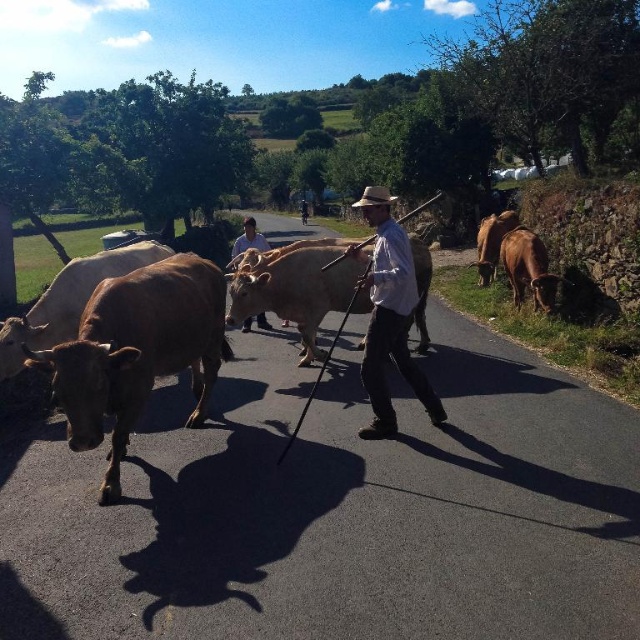
Does brown matte cow at left appear on the left side of brown matte bull at right?

Indeed, brown matte cow at left is positioned on the left side of brown matte bull at right.

Is brown matte cow at left further to the viewer compared to brown matte bull at right?

No, it is not.

Is point (125, 403) in front of point (547, 280)?

That is True.

Identify the location of brown matte cow at left. (138, 352).

Does point (396, 310) come farther from viewer compared to point (540, 280)?

No, (396, 310) is closer to viewer.

Is light brown cotton shirt at center shorter than brown matte bull at right?

Incorrect, light brown cotton shirt at center's height does not fall short of brown matte bull at right's.

The height and width of the screenshot is (640, 640). I want to click on light brown cotton shirt at center, so click(390, 324).

Image resolution: width=640 pixels, height=640 pixels. Find the location of `light brown cotton shirt at center`. light brown cotton shirt at center is located at coordinates (390, 324).

Can you confirm if brown matte cow at left is positioned to the left of white shirt at center?

No, brown matte cow at left is not to the left of white shirt at center.

Does brown matte cow at left lie in front of white shirt at center?

Yes, brown matte cow at left is in front of white shirt at center.

This screenshot has width=640, height=640. Identify the location of brown matte cow at left. (138, 352).

Where is `brown matte cow at left`? The height and width of the screenshot is (640, 640). brown matte cow at left is located at coordinates (138, 352).